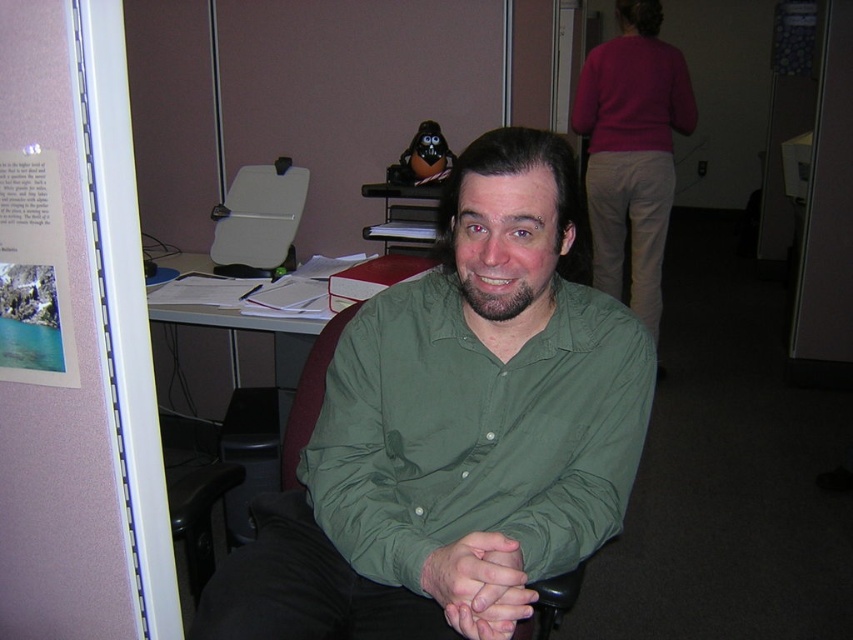
Question: Does green matte shirt at center have a smaller size compared to green matte hands at center?

Choices:
 (A) yes
 (B) no

Answer: (B)

Question: Among these points, which one is farthest from the camera?

Choices:
 (A) (523, 426)
 (B) (288, 419)
 (C) (633, 138)

Answer: (C)

Question: Which point is farther to the camera?

Choices:
 (A) tap(316, 406)
 (B) tap(575, 132)
 (C) tap(556, 266)
 (D) tap(503, 621)

Answer: (B)

Question: Is green matte hands at center positioned at the back of green fabric chair at center?

Choices:
 (A) no
 (B) yes

Answer: (A)

Question: Is green matte shirt at center to the left of green matte dress shirt at center from the viewer's perspective?

Choices:
 (A) yes
 (B) no

Answer: (A)

Question: Which of the following is the closest to the observer?

Choices:
 (A) (575, 394)
 (B) (462, 557)
 (C) (299, 435)

Answer: (B)